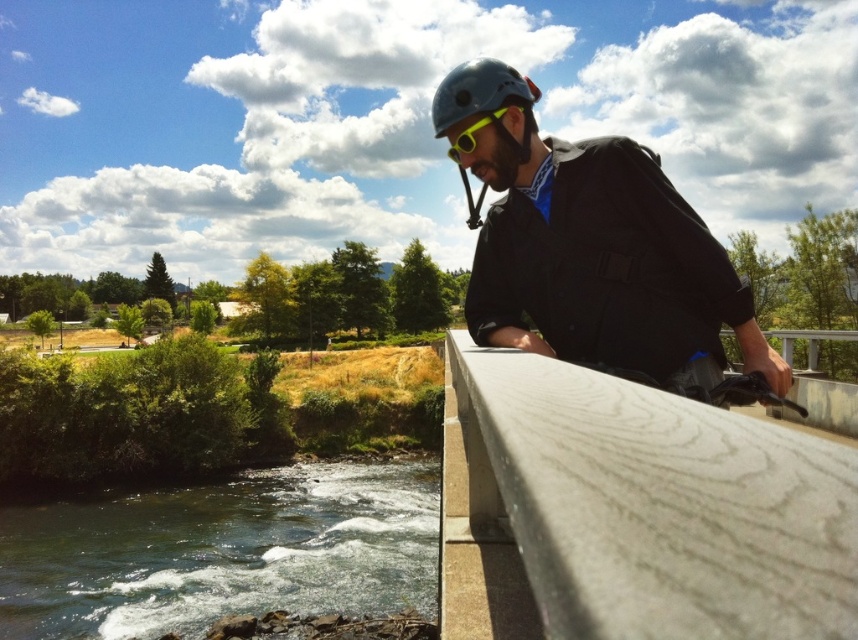
You are a photographer holding a camera that is 25 centimeters wide. You want to place your camera on the smooth concrete ledge at upper right to take a photo of the man leaning on the bridge. Will the camera fit on the ledge?

The smooth concrete ledge at upper right is 24.36 centimeters from camera. Since the camera is 25 centimeters wide, it will not fit on the ledge as the ledge is narrower than the camera.